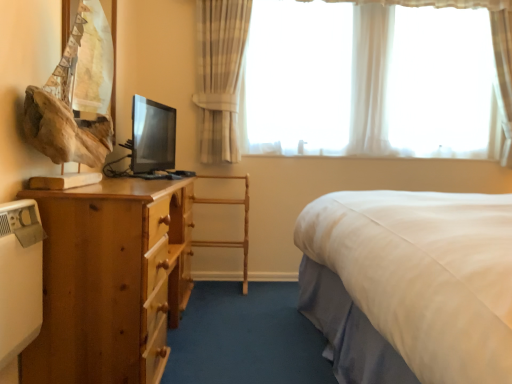
Image resolution: width=512 pixels, height=384 pixels. Describe the element at coordinates (111, 280) in the screenshot. I see `wooden nightstand at left` at that location.

Find the location of a particular element. wooden chair at center is located at coordinates (244, 223).

This screenshot has height=384, width=512. In order to click on wooden nightstand at left in this screenshot , I will do `click(111, 280)`.

Visually, is wooden nightstand at left positioned to the left or to the right of white sheer curtains at upper center?

Based on their positions, wooden nightstand at left is located to the left of white sheer curtains at upper center.

Would you say wooden nightstand at left is inside or outside white sheer curtains at upper center?

wooden nightstand at left is not enclosed by white sheer curtains at upper center.

Is point (125, 218) farther from camera compared to point (377, 145)?

That is False.

Between wooden chair at center and white sheer curtains at upper center, which one has less height?

wooden chair at center is shorter.

Can you confirm if wooden chair at center is positioned to the left of white sheer curtains at upper center?

Correct, you'll find wooden chair at center to the left of white sheer curtains at upper center.

Looking at the image, does wooden chair at center seem bigger or smaller compared to white sheer curtains at upper center?

wooden chair at center is smaller than white sheer curtains at upper center.

Does point (197, 245) come closer to viewer compared to point (165, 248)?

No, (197, 245) is further to viewer.

From a real-world perspective, is wooden chair at center below wooden nightstand at left?

No, from a real-world perspective, wooden chair at center is not below wooden nightstand at left.

Is wooden chair at center looking in the opposite direction of wooden nightstand at left?

No, wooden chair at center's orientation is not away from wooden nightstand at left.

Could wooden nightstand at left be considered to be inside wooden chair at center?

Actually, wooden nightstand at left is outside wooden chair at center.

How far apart are wooden nightstand at left and wooden chair at center?

4.17 feet.

From a real-world perspective, which is physically above, wooden nightstand at left or wooden chair at center?

wooden chair at center.

In the scene shown: Could you tell me if wooden nightstand at left is turned towards wooden chair at center?

No, wooden nightstand at left is not turned towards wooden chair at center.

Is wooden chair at center a part of wooden nightstand at left?

No, wooden chair at center is not surrounded by wooden nightstand at left.

Is wooden nightstand at left wider than wooden drawer at lower left?

Indeed, wooden nightstand at left has a greater width compared to wooden drawer at lower left.

Is wooden nightstand at left in front of wooden drawer at lower left?

Yes, it is.

From the picture: Is there a large distance between wooden nightstand at left and wooden drawer at lower left?

Actually, wooden nightstand at left and wooden drawer at lower left are a little close together.

From the image's perspective, who appears lower, white sheer curtains at upper center or wooden drawer at lower left?

wooden drawer at lower left appears lower in the image.

Is white sheer curtains at upper center in front of or behind wooden drawer at lower left in the image?

Visually, white sheer curtains at upper center is located behind wooden drawer at lower left.

Considering the relative sizes of white sheer curtains at upper center and wooden drawer at lower left in the image provided, is white sheer curtains at upper center thinner than wooden drawer at lower left?

In fact, white sheer curtains at upper center might be wider than wooden drawer at lower left.

Considering the positions of objects white sheer curtains at upper center and wooden drawer at lower left in the image provided, who is more to the left, white sheer curtains at upper center or wooden drawer at lower left?

From the viewer's perspective, wooden drawer at lower left appears more on the left side.

Consider the image. Is white sheer curtains at upper center at the right side of wooden chair at center?

Correct, you'll find white sheer curtains at upper center to the right of wooden chair at center.

From the image's perspective, is white sheer curtains at upper center over wooden chair at center?

Yes, from the image's perspective, white sheer curtains at upper center is above wooden chair at center.

Which object is closer to the camera taking this photo, white sheer curtains at upper center or wooden chair at center?

wooden chair at center.

In order to click on nightstand that appears below the white sheer curtains at upper center (from a real-world perspective) in this screenshot , I will do `click(111, 280)`.

In order to click on window above the wooden chair at center (from a real-world perspective) in this screenshot , I will do `click(220, 73)`.

When comparing their distances from wooden drawer at lower left, does white sheer curtains at upper center or wooden chair at center seem further?

Based on the image, white sheer curtains at upper center appears to be further to wooden drawer at lower left.

Based on their spatial positions, is wooden chair at center or wooden nightstand at left further from wooden drawer at lower left?

wooden chair at center lies further to wooden drawer at lower left than the other object.

Considering their positions, is wooden nightstand at left positioned closer to white sheer curtains at upper center than wooden drawer at lower left?

wooden drawer at lower left.

Estimate the real-world distances between objects in this image. Which object is further from wooden nightstand at left, wooden chair at center or wooden drawer at lower left?

Among the two, wooden chair at center is located further to wooden nightstand at left.

When comparing their distances from white sheer curtains at upper center, does wooden chair at center or wooden drawer at lower left seem further?

Based on the image, wooden drawer at lower left appears to be further to white sheer curtains at upper center.

From the image, which object appears to be nearer to wooden nightstand at left, wooden drawer at lower left or white sheer curtains at upper center?

Based on the image, wooden drawer at lower left appears to be nearer to wooden nightstand at left.

Which object lies nearer to the anchor point wooden chair at center, wooden drawer at lower left or white sheer curtains at upper center?

Based on the image, wooden drawer at lower left appears to be nearer to wooden chair at center.

Considering their positions, is white sheer curtains at upper center positioned closer to wooden nightstand at left than wooden chair at center?

wooden chair at center is closer to wooden nightstand at left.

At what (x,y) coordinates should I click in order to perform the action: click on chair between white sheer curtains at upper center and wooden drawer at lower left vertically. Please return your answer as a coordinate pair (x, y). This screenshot has width=512, height=384. Looking at the image, I should click on (244, 223).

The height and width of the screenshot is (384, 512). In order to click on chair positioned between wooden nightstand at left and white sheer curtains at upper center from near to far in this screenshot , I will do `click(244, 223)`.

Where is `drawer between wooden nightstand at left and wooden chair at center in the front-back direction`? This screenshot has height=384, width=512. drawer between wooden nightstand at left and wooden chair at center in the front-back direction is located at coordinates (164, 277).

Identify the location of drawer positioned between wooden nightstand at left and white sheer curtains at upper center from near to far. This screenshot has width=512, height=384. (164, 277).